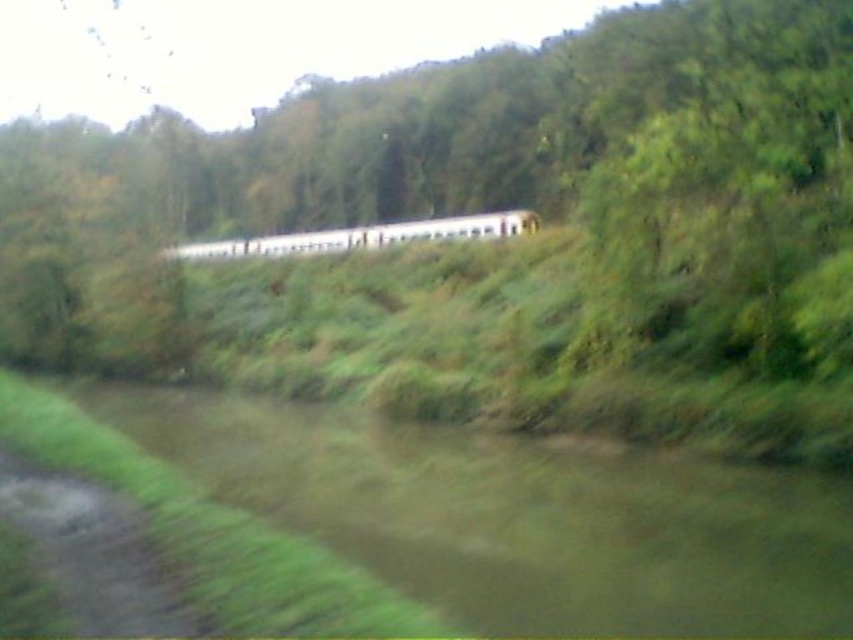
You are a wildlife photographer aiming to capture a photo of the white matte passenger train at center passing by the brown muddy river at lower left. Your camera has a maximum range of 40 meters. Can you take the photo from your current position?

The distance between the brown muddy river at lower left and the white matte passenger train at center is 42.85 meters, which exceeds the camera range of 40 meters. You cannot take the photo from your current position.

You are standing at the origin point of the coordinate system placed at the bottom left corner of the image. You want to cross the river to reach the forest on the right. What are the coordinates of the brown muddy river at lower left that you need to cross?

The coordinates of the brown muddy river at lower left are at point [515,515].

You are a photographer planning to capture the entire white matte passenger train at center and the brown muddy river at lower left in a single frame. Given their widths, which object will occupy more space horizontally in the photo?

The white matte passenger train at center is wider than the brown muddy river at lower left, so it will occupy more horizontal space in the photo.